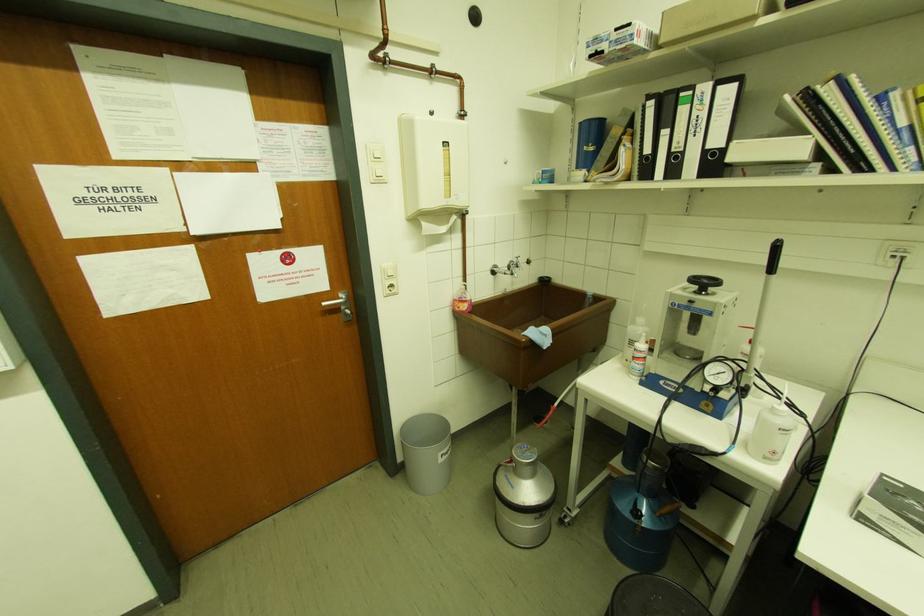
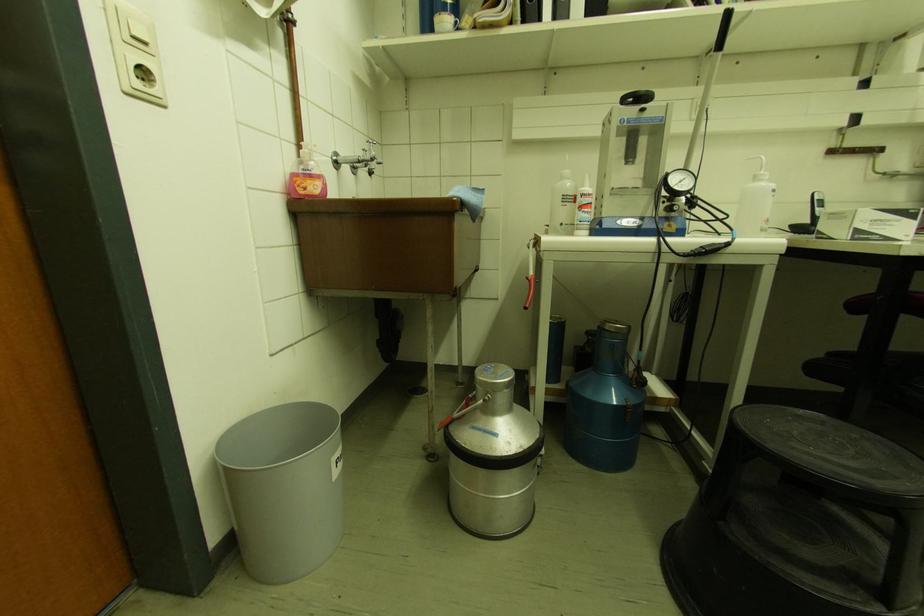
Locate, in the second image, the point that corresponds to the point at 647,342 in the first image.

(590, 185)